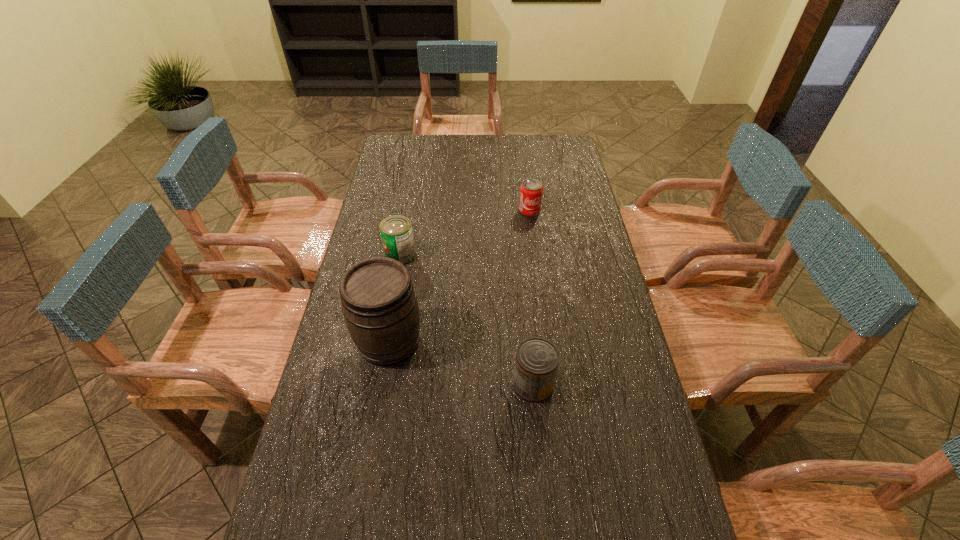
This screenshot has width=960, height=540. I want to click on wine bucket, so click(x=379, y=303).

Identify the location of the nearest can. The height and width of the screenshot is (540, 960). (536, 362).

At what (x,y) coordinates should I click in order to perform the action: click on the second nearest can. Please return your answer as a coordinate pair (x, y). The height and width of the screenshot is (540, 960). Looking at the image, I should click on (396, 231).

Locate an element on the screen. The image size is (960, 540). the third nearest object is located at coordinates (396, 231).

I want to click on the farthest can, so coord(531,190).

This screenshot has height=540, width=960. What are the coordinates of `free region located on the right of the wine bucket` in the screenshot? It's located at (536, 341).

Image resolution: width=960 pixels, height=540 pixels. What are the coordinates of `blank space located on the back of the nearest can` in the screenshot? It's located at (529, 339).

This screenshot has height=540, width=960. In order to click on vacant area situated 0.360m on the right of the second farthest object in this screenshot , I will do `click(517, 255)`.

At what (x,y) coordinates should I click in order to perform the action: click on vacant point located 0.300m on the front of the farthest object. Please return your answer as a coordinate pair (x, y). The image size is (960, 540). Looking at the image, I should click on (538, 272).

At what (x,y) coordinates should I click in order to perform the action: click on wine bucket at the left edge. Please return your answer as a coordinate pair (x, y). This screenshot has height=540, width=960. Looking at the image, I should click on (379, 303).